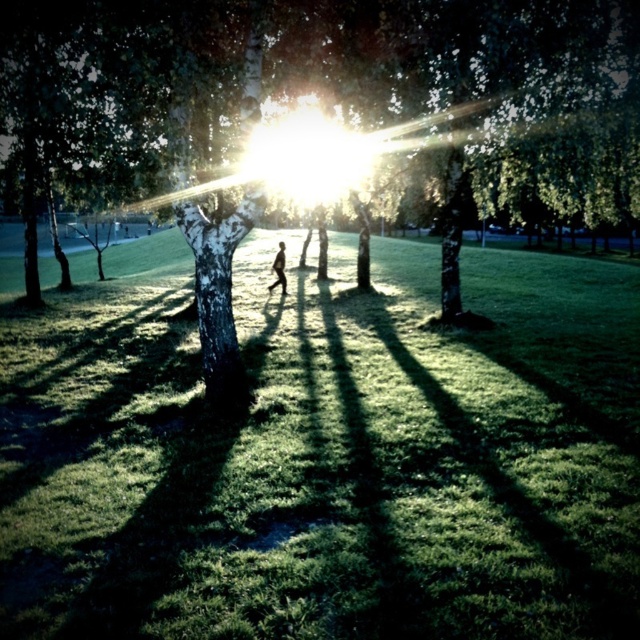
Between point (92, 355) and point (326, 156), which one is positioned behind?

Positioned behind is point (326, 156).

How far apart are green grassy at center and green matte tree at center?

green grassy at center and green matte tree at center are 5.65 meters apart from each other.

Is point (595, 292) positioned after point (189, 216)?

Yes, it is behind point (189, 216).

This screenshot has width=640, height=640. Identify the location of green grassy at center. (324, 452).

Between green matte tree at center and dark skin person at center, which one has more height?

green matte tree at center

What are the coordinates of `green matte tree at center` in the screenshot? It's located at (371, 113).

Can you confirm if green grassy at center is positioned below dark skin person at center?

Yes.

Does green grassy at center appear on the right side of dark skin person at center?

Yes, green grassy at center is to the right of dark skin person at center.

Which is behind, point (307, 371) or point (268, 289)?

The point (268, 289) is more distant.

Where is `green grassy at center`? This screenshot has width=640, height=640. green grassy at center is located at coordinates (324, 452).